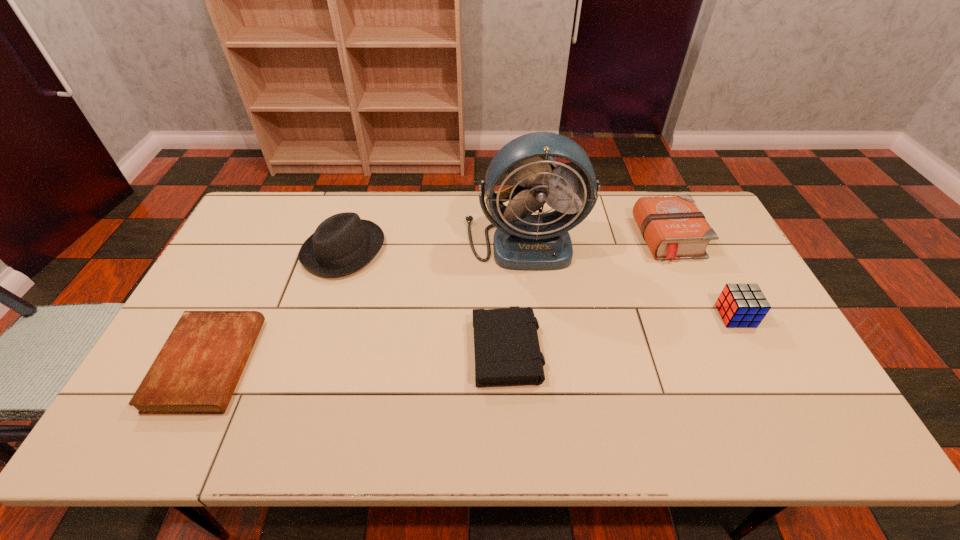
The height and width of the screenshot is (540, 960). Find the location of `object present at the left edge`. object present at the left edge is located at coordinates (198, 368).

Locate an element on the screen. Bible that is at the right edge is located at coordinates (673, 227).

Identify the location of cube that is at the right edge. (740, 305).

You are a GUI agent. You are given a task and a screenshot of the screen. Output one action in this format:
    pyautogui.click(x=<x>, y=<y>)
    Task: Click on the object positioned at the near left corner
    The height and width of the screenshot is (540, 960).
    Given the screenshot: What is the action you would take?
    [x=198, y=368]

Locate an element on the screen. This screenshot has width=960, height=540. object present at the far right corner is located at coordinates (673, 227).

Find the location of a particular element. vacant region at the far edge is located at coordinates (452, 218).

Where is `vacant space at the near edge of the desktop`? The width and height of the screenshot is (960, 540). vacant space at the near edge of the desktop is located at coordinates (604, 415).

I want to click on free region at the left edge, so click(x=249, y=247).

I want to click on free space at the right edge, so click(813, 386).

Locate an element on the screen. The image size is (960, 540). free region at the far left corner of the desktop is located at coordinates (295, 215).